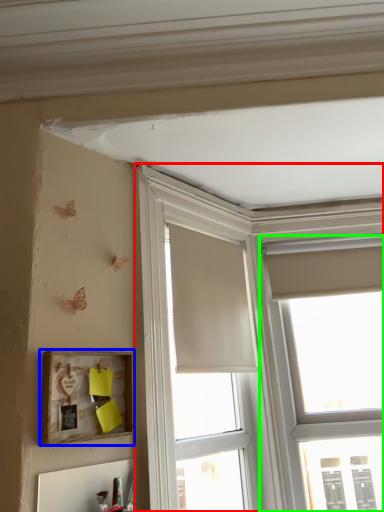
Question: Which is nearer to the window (highlighted by a red box)? picture frame (highlighted by a blue box) or window (highlighted by a green box).

Choices:
 (A) picture frame
 (B) window

Answer: (B)